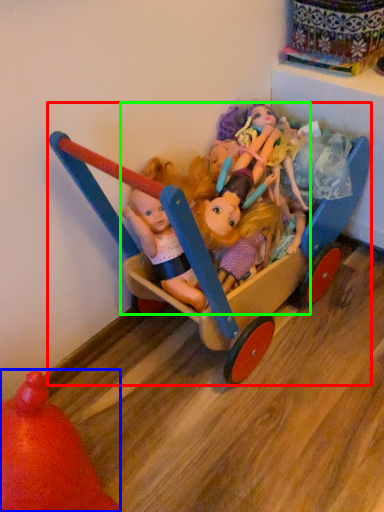
Question: Considering the real-world distances, which object is closest to toy (highlighted by a red box)? toy (highlighted by a blue box) or doll (highlighted by a green box).

Choices:
 (A) toy
 (B) doll

Answer: (B)